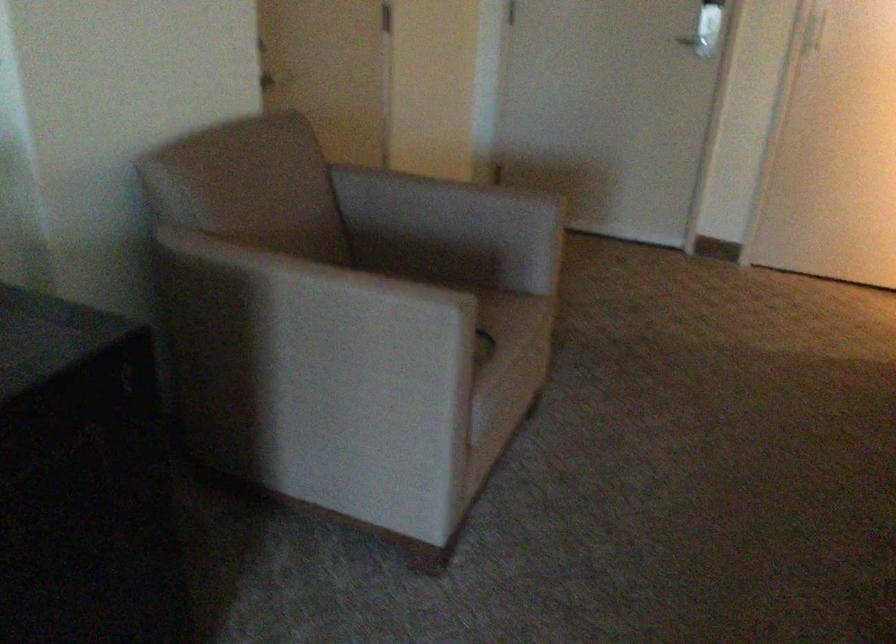
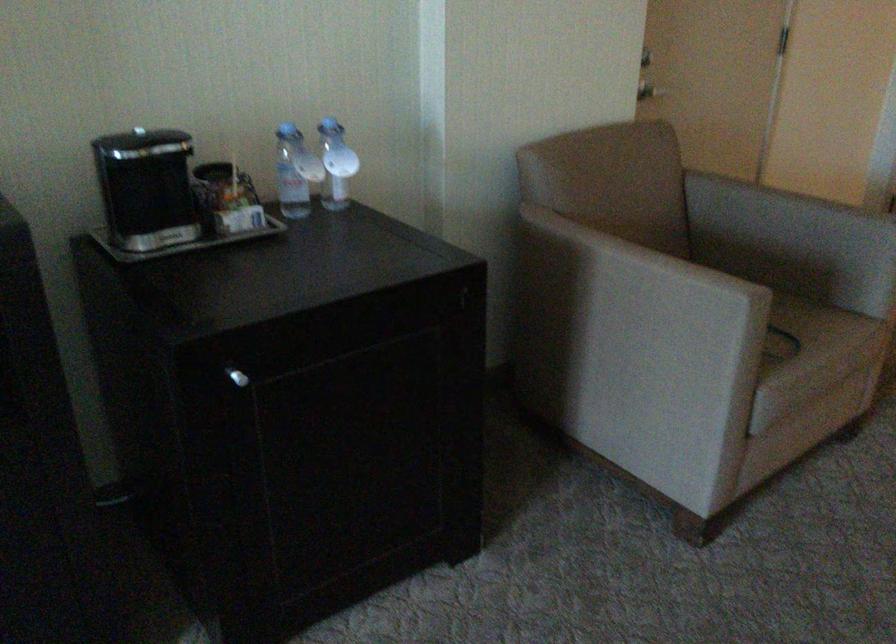
In the second image, find the point that corresponds to (x=496, y=335) in the first image.

(811, 335)